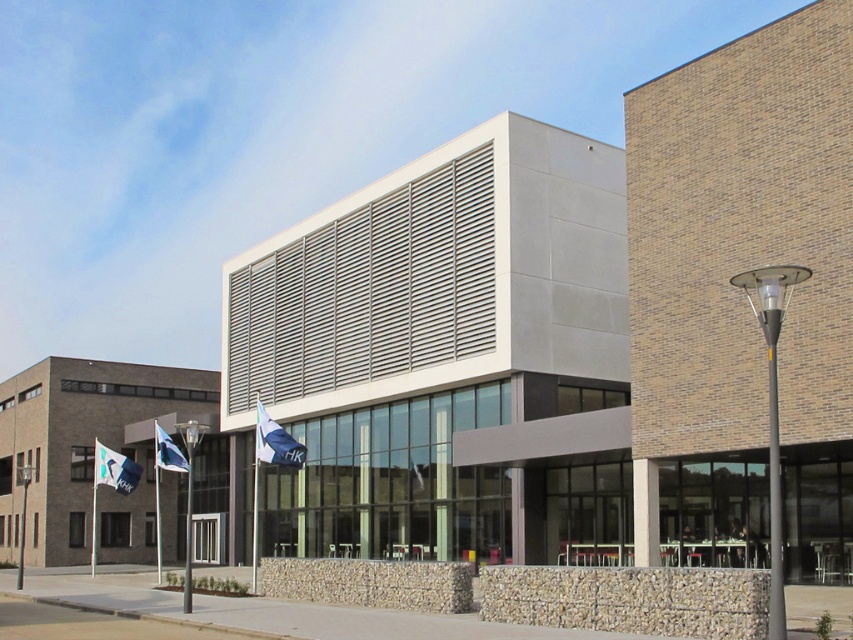
How distant is blue fabric flag at center from white fabric flag at center?

blue fabric flag at center and white fabric flag at center are 5.12 meters apart from each other.

This screenshot has width=853, height=640. Describe the element at coordinates (276, 442) in the screenshot. I see `blue fabric flag at center` at that location.

Which is in front, point (297, 464) or point (171, 440)?

Point (297, 464)

Image resolution: width=853 pixels, height=640 pixels. What are the coordinates of `blue fabric flag at center` in the screenshot? It's located at (276, 442).

Which is more to the right, black metal lamp post at center or metallic gray pole at left?

black metal lamp post at center is more to the right.

Is black metal lamp post at center below metallic gray pole at left?

No.

Which is in front, point (189, 451) or point (20, 476)?

Point (189, 451) is in front.

Identify the location of black metal lamp post at center. The image size is (853, 640). (189, 499).

Is black metal pole at right positioned at the back of white fabric flag at lower left?

That is False.

Can you confirm if black metal pole at right is thinner than white fabric flag at lower left?

Yes, black metal pole at right is thinner than white fabric flag at lower left.

Where is `black metal pole at right`? The image size is (853, 640). black metal pole at right is located at coordinates (772, 406).

Identify the location of black metal pole at right. Image resolution: width=853 pixels, height=640 pixels. (772, 406).